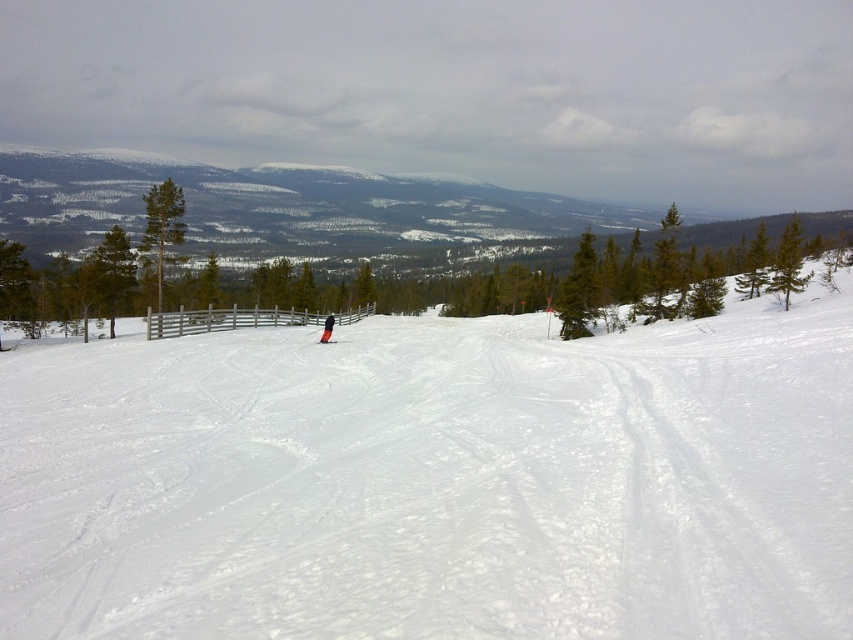
Can you confirm if white powdery snow at center is thinner than orange fabric ski at center?

Incorrect, white powdery snow at center's width is not less than orange fabric ski at center's.

Is white powdery snow at center to the right of orange fabric ski at center from the viewer's perspective?

Yes, white powdery snow at center is to the right of orange fabric ski at center.

What do you see at coordinates (434, 481) in the screenshot? The height and width of the screenshot is (640, 853). I see `white powdery snow at center` at bounding box center [434, 481].

At what (x,y) coordinates should I click in order to perform the action: click on white powdery snow at center. Please return your answer as a coordinate pair (x, y). This screenshot has height=640, width=853. Looking at the image, I should click on (434, 481).

Which is below, white powdery snow at center or black fabric person at center?

white powdery snow at center is below.

Where is `white powdery snow at center`? The width and height of the screenshot is (853, 640). white powdery snow at center is located at coordinates (434, 481).

Identify the location of white powdery snow at center. The image size is (853, 640). (434, 481).

In order to click on black fabric person at center in this screenshot , I will do `click(328, 328)`.

Locate an element on the screen. black fabric person at center is located at coordinates (328, 328).